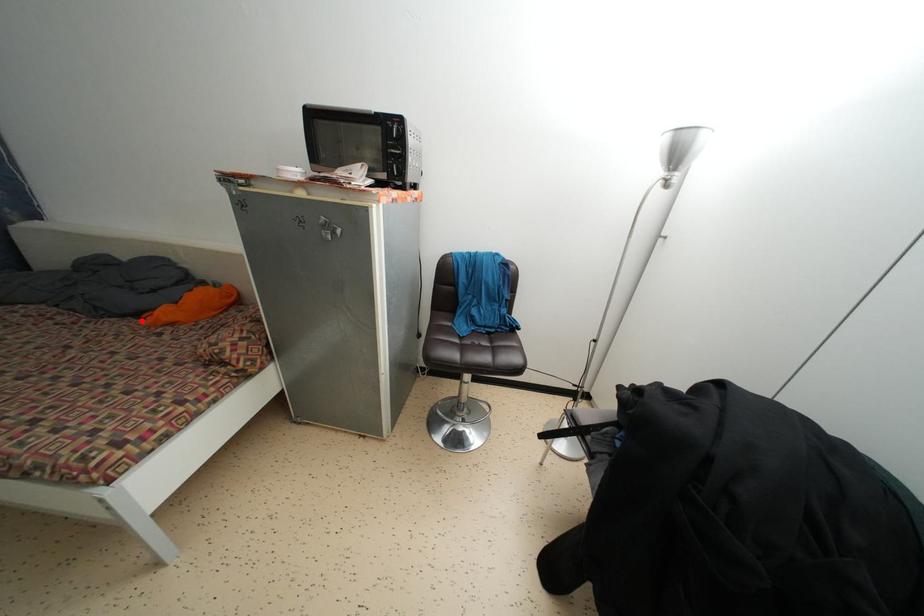
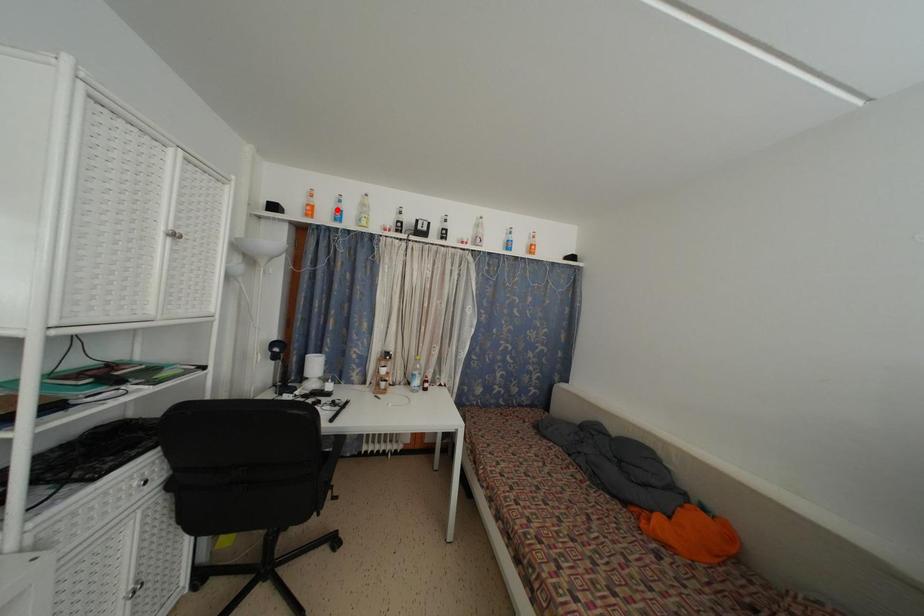
I am providing you with two images of the same scene from different viewpoints. A red point is marked on the first image and another point is marked on the second image. Does the point marked in image1 correspond to the same location as the one in image2?

No